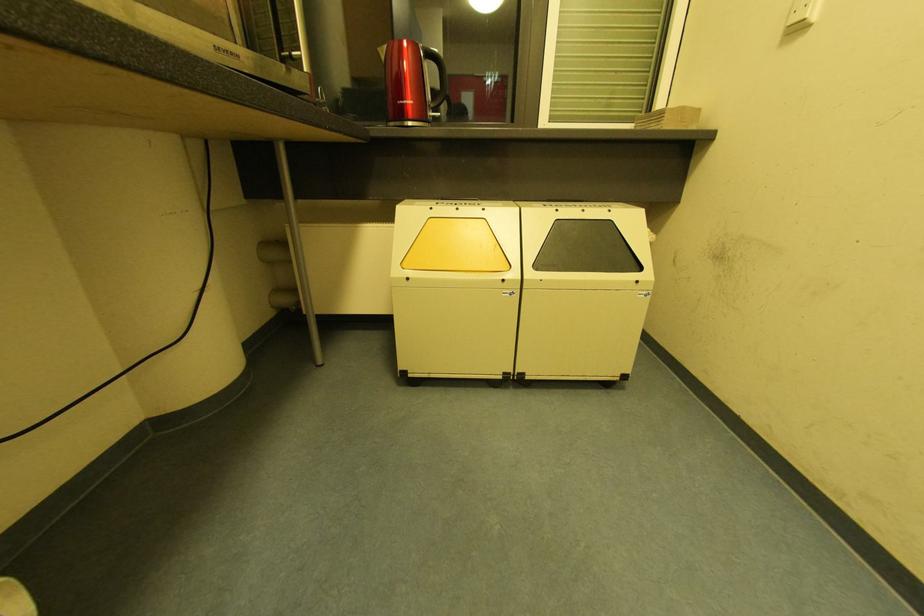
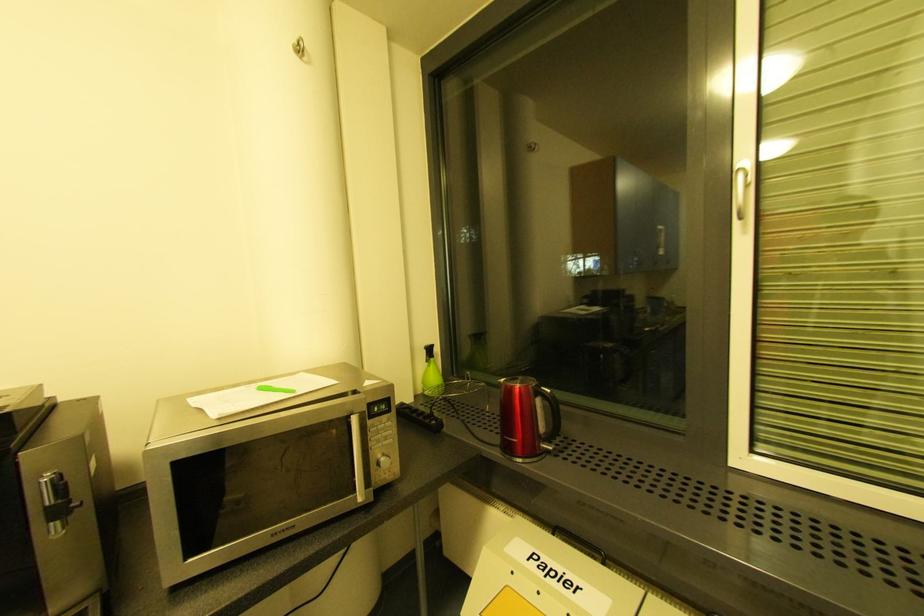
Question: How did the camera likely rotate?

Choices:
 (A) Left
 (B) Right
 (C) Up
 (D) Down

Answer: (A)